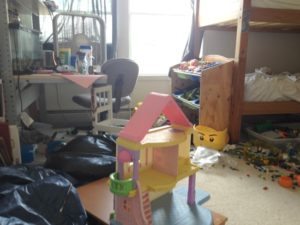
Where is `curtains`? Image resolution: width=300 pixels, height=225 pixels. curtains is located at coordinates (100, 3), (74, 9).